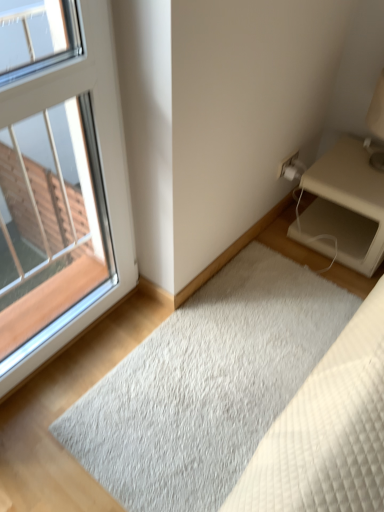
The height and width of the screenshot is (512, 384). Describe the element at coordinates (346, 205) in the screenshot. I see `beige matte nightstand at right` at that location.

At what (x,y) coordinates should I click in order to perform the action: click on beige matte nightstand at right. Please return your answer as a coordinate pair (x, y). The width and height of the screenshot is (384, 512). Looking at the image, I should click on (346, 205).

Is white shaggy rug at lower center not inside white plastic window at upper left?

Yes, white shaggy rug at lower center is outside of white plastic window at upper left.

In the scene shown: Can you tell me how much white shaggy rug at lower center and white plastic window at upper left differ in facing direction?

The angular difference between white shaggy rug at lower center and white plastic window at upper left is 90.2 degrees.

Considering the relative sizes of white shaggy rug at lower center and white plastic window at upper left in the image provided, is white shaggy rug at lower center thinner than white plastic window at upper left?

In fact, white shaggy rug at lower center might be wider than white plastic window at upper left.

Consider the image. Which is behind, white shaggy rug at lower center or white plastic window at upper left?

white shaggy rug at lower center is behind.

Is white shaggy rug at lower center oriented away from beige matte nightstand at right?

That's right, white shaggy rug at lower center is facing away from beige matte nightstand at right.

Considering the relative sizes of white shaggy rug at lower center and beige matte nightstand at right in the image provided, is white shaggy rug at lower center shorter than beige matte nightstand at right?

Correct, white shaggy rug at lower center is not as tall as beige matte nightstand at right.

What's the angular difference between white shaggy rug at lower center and beige matte nightstand at right's facing directions?

2.08 degrees.

Between white shaggy rug at lower center and beige matte nightstand at right, which one appears on the left side from the viewer's perspective?

From the viewer's perspective, white shaggy rug at lower center appears more on the left side.

Measure the distance between white plastic window at upper left and white shaggy rug at lower center.

white plastic window at upper left is 22.81 inches away from white shaggy rug at lower center.

Between white plastic window at upper left and white shaggy rug at lower center, which one has more height?

A: white plastic window at upper left is taller.

In the scene shown: Could you tell me if white plastic window at upper left is facing white shaggy rug at lower center?

Yes.

Which of these two, white plastic window at upper left or white shaggy rug at lower center, is smaller?

With smaller size is white shaggy rug at lower center.

In the image, is white plastic window at upper left on the left side or the right side of beige matte nightstand at right?

white plastic window at upper left is positioned on beige matte nightstand at right's left side.

How distant is white plastic window at upper left from beige matte nightstand at right?

white plastic window at upper left is 97.92 centimeters from beige matte nightstand at right.

Considering the sizes of objects white plastic window at upper left and beige matte nightstand at right in the image provided, who is bigger, white plastic window at upper left or beige matte nightstand at right?

With larger size is white plastic window at upper left.

From a real-world perspective, which object rests below the other?

From a 3D spatial view, beige matte nightstand at right is below.

Which object is closer to the camera taking this photo, beige matte nightstand at right or white shaggy rug at lower center?

white shaggy rug at lower center is more forward.

Is beige matte nightstand at right completely or partially outside of white shaggy rug at lower center?

Yes, beige matte nightstand at right is not within white shaggy rug at lower center.

Consider the image. Which of these two, beige matte nightstand at right or white shaggy rug at lower center, stands taller?

With more height is beige matte nightstand at right.

From a real-world perspective, is beige matte nightstand at right above or below white shaggy rug at lower center?

From a real-world perspective, beige matte nightstand at right is physically above white shaggy rug at lower center.

Identify the location of window above the beige matte nightstand at right (from a real-world perspective). This screenshot has height=512, width=384. (63, 200).

Does beige matte nightstand at right have a larger size compared to white plastic window at upper left?

Actually, beige matte nightstand at right might be smaller than white plastic window at upper left.

From a real-world perspective, is beige matte nightstand at right positioned above or below white plastic window at upper left?

In terms of real-world spatial position, beige matte nightstand at right is below white plastic window at upper left.

Where is `doormat lying behind the white plastic window at upper left`? The width and height of the screenshot is (384, 512). doormat lying behind the white plastic window at upper left is located at coordinates (206, 385).

Where is `doormat that is under the beige matte nightstand at right (from a real-world perspective)`? doormat that is under the beige matte nightstand at right (from a real-world perspective) is located at coordinates (206, 385).

From the image, which object appears to be nearer to white shaggy rug at lower center, beige matte nightstand at right or white plastic window at upper left?

beige matte nightstand at right lies closer to white shaggy rug at lower center than the other object.

Consider the image. Based on their spatial positions, is white shaggy rug at lower center or white plastic window at upper left closer to beige matte nightstand at right?

The object closer to beige matte nightstand at right is white shaggy rug at lower center.

Looking at the image, which one is located closer to white plastic window at upper left, beige matte nightstand at right or white shaggy rug at lower center?

white shaggy rug at lower center lies closer to white plastic window at upper left than the other object.

Based on their spatial positions, is white shaggy rug at lower center or beige matte nightstand at right further from white plastic window at upper left?

The object further to white plastic window at upper left is beige matte nightstand at right.

When comparing their distances from beige matte nightstand at right, does white plastic window at upper left or white shaggy rug at lower center seem further?

The object further to beige matte nightstand at right is white plastic window at upper left.

Looking at this image, estimate the real-world distances between objects in this image. Which object is further from white shaggy rug at lower center, white plastic window at upper left or beige matte nightstand at right?

Based on the image, white plastic window at upper left appears to be further to white shaggy rug at lower center.

The height and width of the screenshot is (512, 384). I want to click on doormat between white plastic window at upper left and beige matte nightstand at right, so click(206, 385).